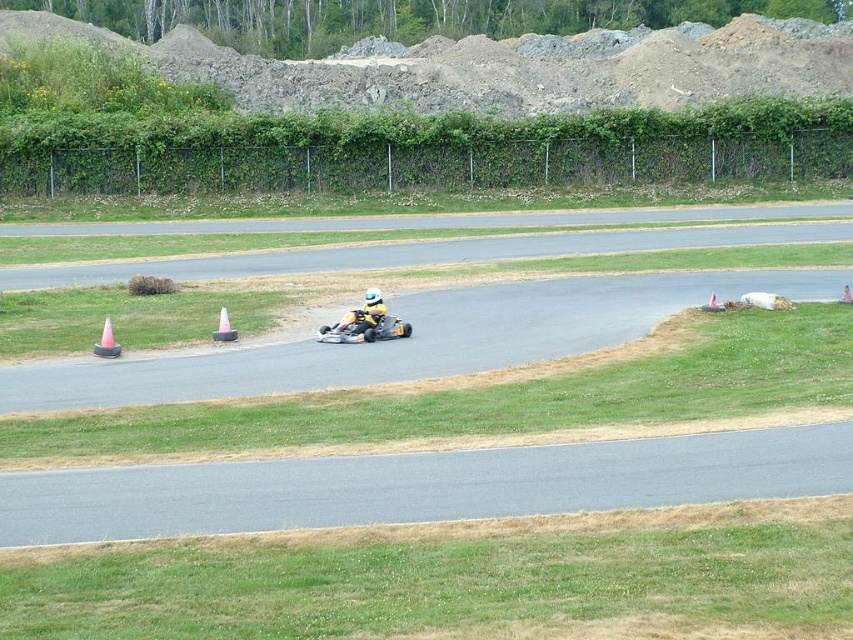
In the scene shown: You are a go kart driver preparing to race on the track. You see a pink plastic traffic cone at left and an orange plastic traffic cone at center. Which cone has a wider base?

The pink plastic traffic cone at left has a wider base than the orange plastic traffic cone at center.